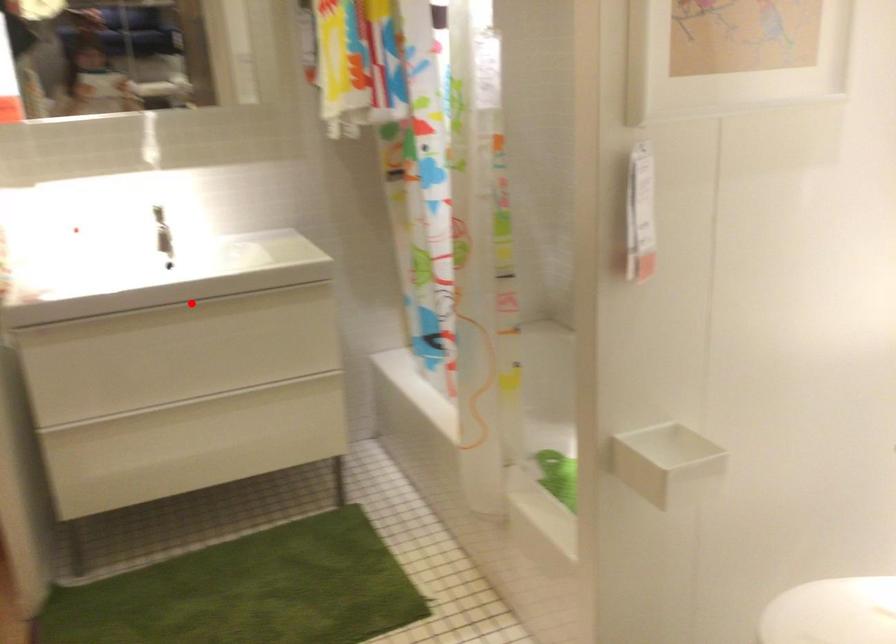
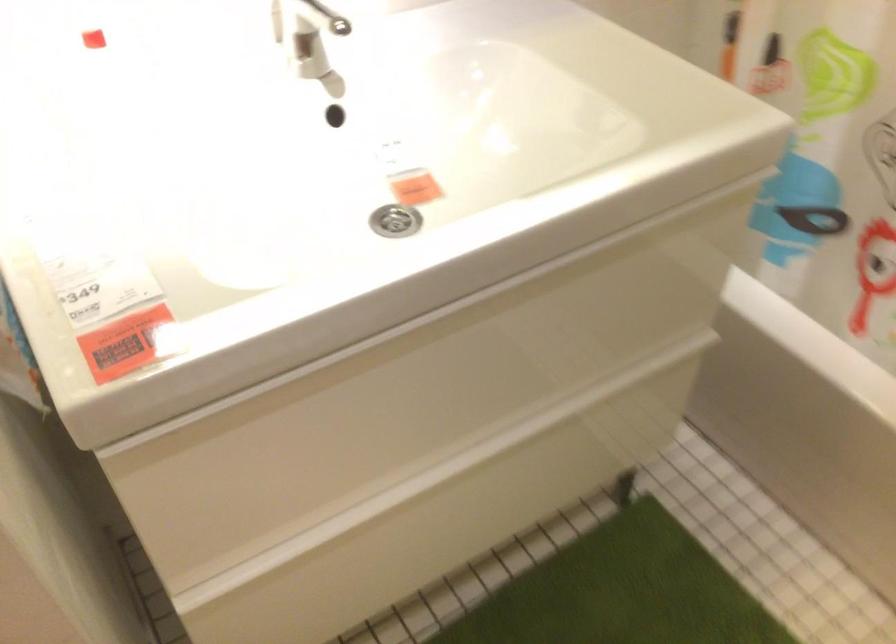
Find the pixel in the second image that matches the highlighted location in the first image.

(394, 221)